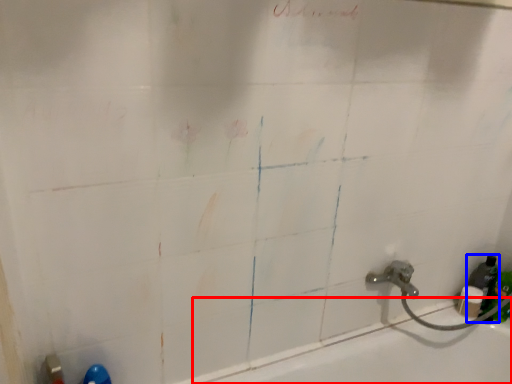
Question: Among these objects, which one is farthest to the camera, bath (highlighted by a red box) or bottle (highlighted by a blue box)?

Choices:
 (A) bath
 (B) bottle

Answer: (B)